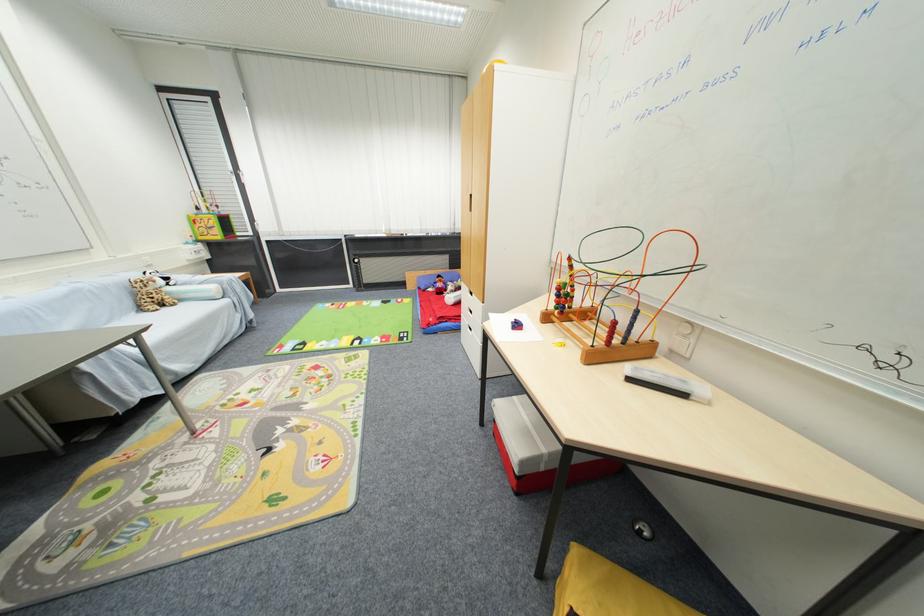
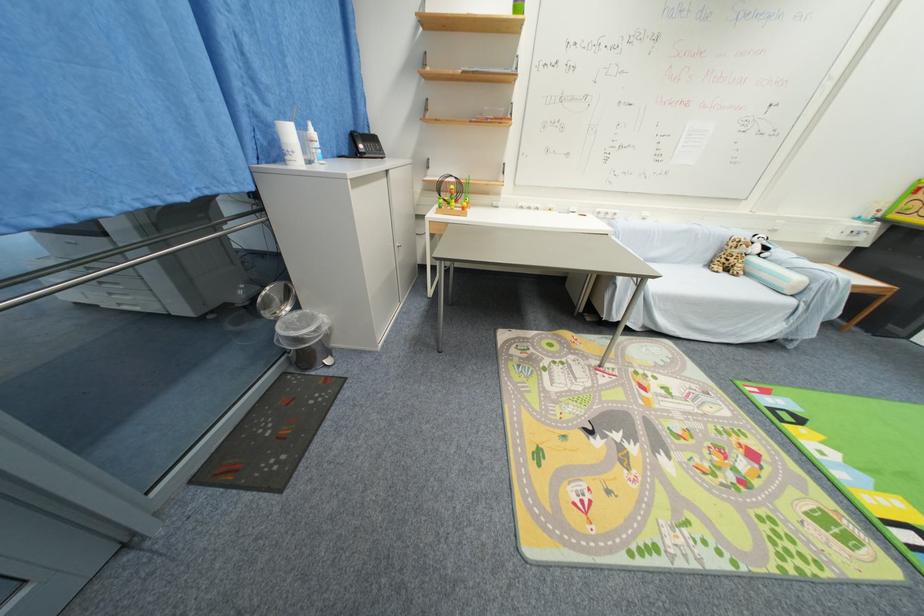
In the second image, find the point that corresponds to point (165, 283) in the first image.

(761, 251)